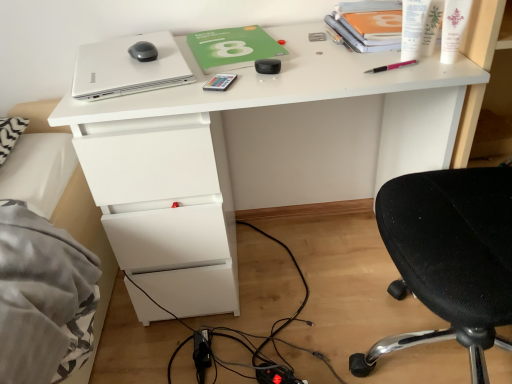
Identify the location of free space in front of matte black mouse at upper left. (131, 72).